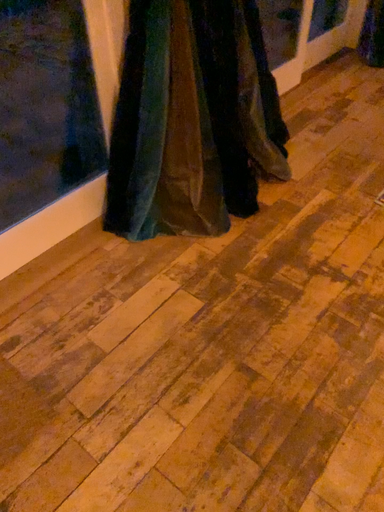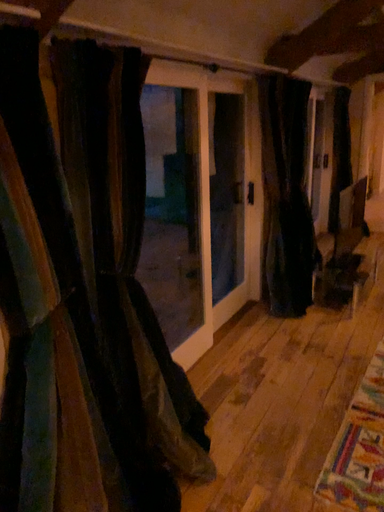
Question: How did the camera likely rotate when shooting the video?

Choices:
 (A) rotated downward
 (B) rotated upward

Answer: (B)